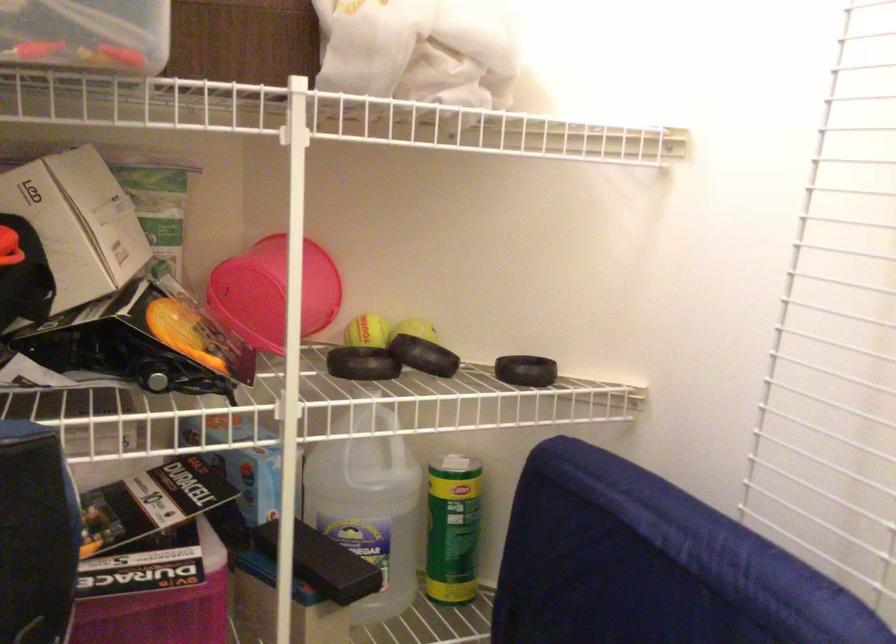
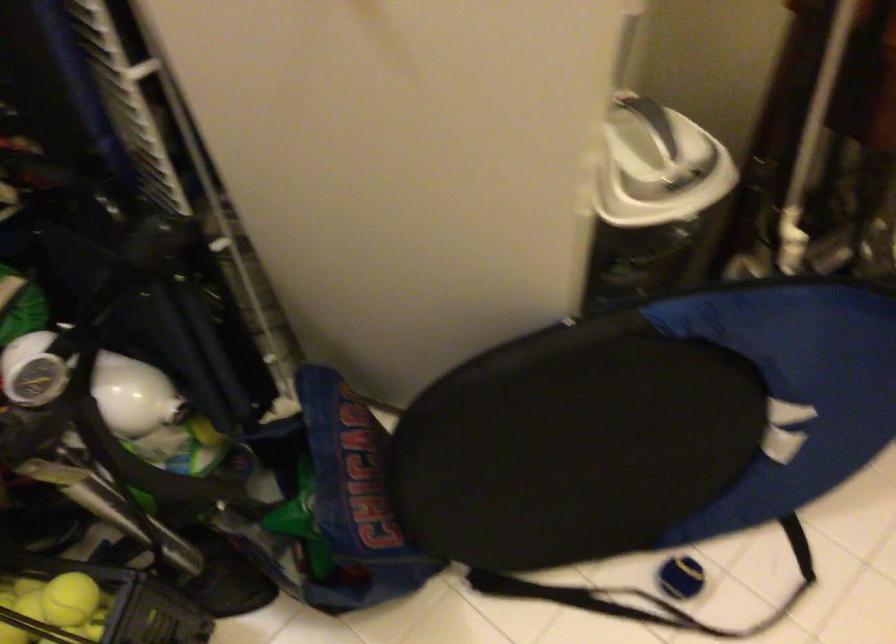
Question: Based on the continuous images, in which direction is the camera rotating? Reply with the corresponding letter.

Choices:
 (A) Left
 (B) Right
 (C) Up
 (D) Down

Answer: (D)